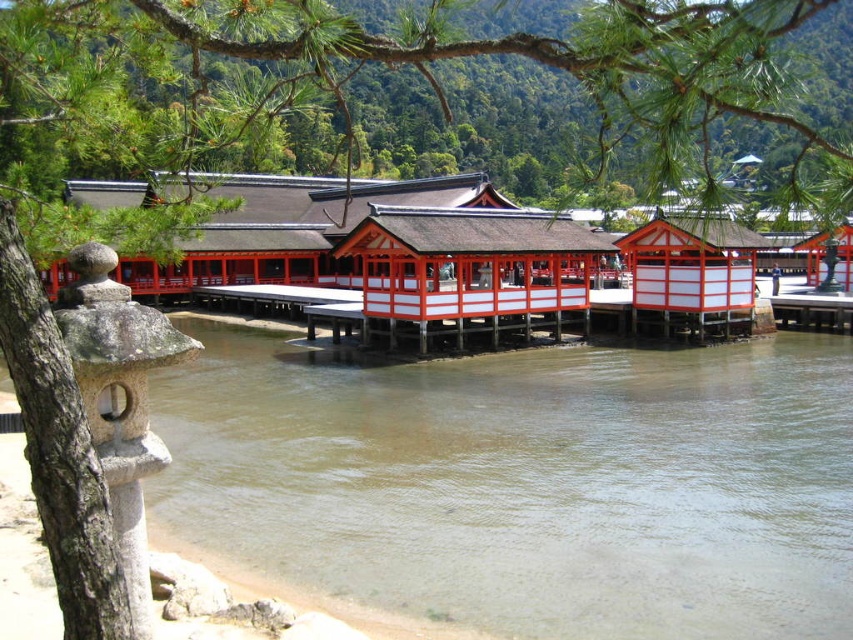
Question: Which object appears closest to the camera in this image?

Choices:
 (A) green leafy branch at upper center
 (B) clear water at river left

Answer: (A)

Question: Which point is farther to the camera?

Choices:
 (A) (596, 369)
 (B) (720, 4)

Answer: (A)

Question: Which of the following is the closest to the observer?

Choices:
 (A) (746, 474)
 (B) (105, 97)

Answer: (B)

Question: Where is clear water at river left located in relation to green leafy branch at upper center in the image?

Choices:
 (A) left
 (B) right

Answer: (A)

Question: Can you confirm if clear water at river left is thinner than green leafy branch at upper center?

Choices:
 (A) yes
 (B) no

Answer: (A)

Question: Does clear water at river left have a larger size compared to green leafy branch at upper center?

Choices:
 (A) no
 (B) yes

Answer: (A)